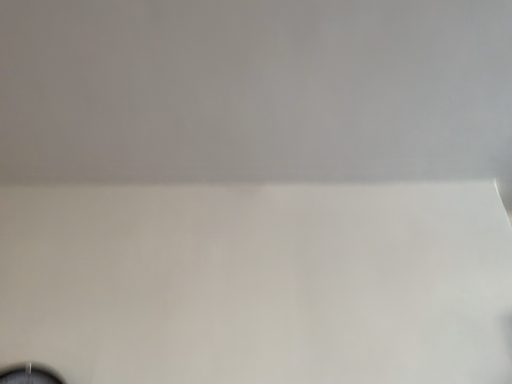
Describe the element at coordinates (29, 375) in the screenshot. I see `black matte clock at lower left` at that location.

Where is `black matte clock at lower left`? Image resolution: width=512 pixels, height=384 pixels. black matte clock at lower left is located at coordinates (29, 375).

Where is `black matte clock at lower left`? The image size is (512, 384). black matte clock at lower left is located at coordinates (29, 375).